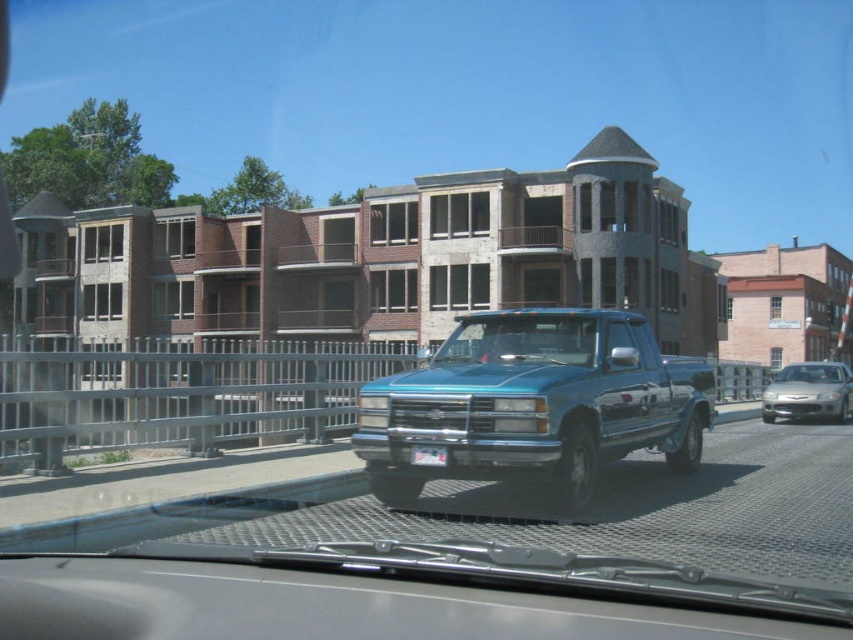
Question: Which is farther from the clear glass windshield at center?

Choices:
 (A) metallic blue pickup truck at center
 (B) silver metallic sedan at right

Answer: (B)

Question: Does silver metallic sedan at right lie behind white plastic license plate at center?

Choices:
 (A) yes
 (B) no

Answer: (A)

Question: Where is metallic blue pickup truck at center located in relation to white plastic license plate at center in the image?

Choices:
 (A) below
 (B) above

Answer: (B)

Question: Based on their relative distances, which object is nearer to the metallic blue pickup truck at center?

Choices:
 (A) clear glass windshield at center
 (B) silver metallic sedan at right
 (C) white plastic license plate at center

Answer: (A)

Question: Can you confirm if clear glass windshield at center is thinner than silver metallic sedan at right?

Choices:
 (A) no
 (B) yes

Answer: (B)

Question: Among these points, which one is nearest to the camera?

Choices:
 (A) (544, 400)
 (B) (775, 396)

Answer: (A)